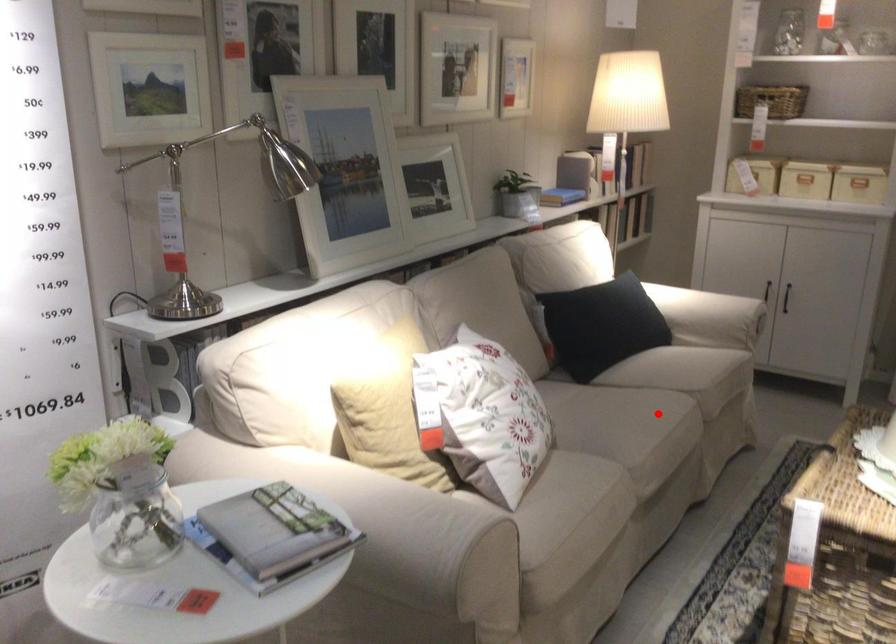
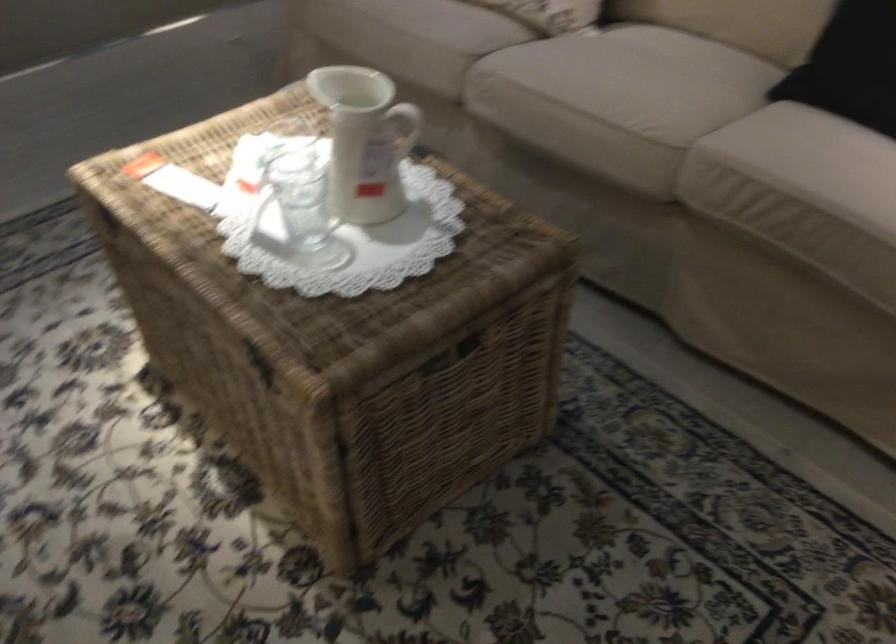
Question: I am providing you with two images of the same scene from different viewpoints. In image1, a red point is highlighted. Considering the same 3D point in image2, which of the following is correct?

Choices:
 (A) It is closer
 (B) It is farther

Answer: (A)